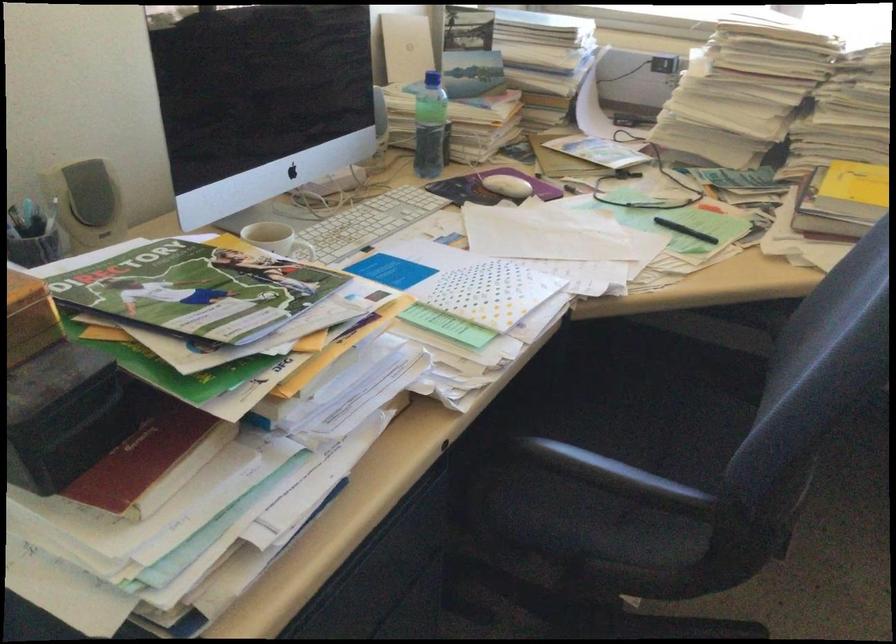
This screenshot has height=644, width=896. I want to click on black chair armrest, so click(x=614, y=474).